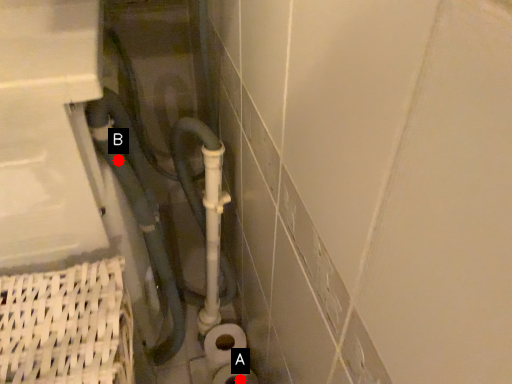
Question: Two points are circled on the image, labeled by A and B beside each circle. Which of the following is the farthest from the observer?

Choices:
 (A) A is further
 (B) B is further

Answer: (A)